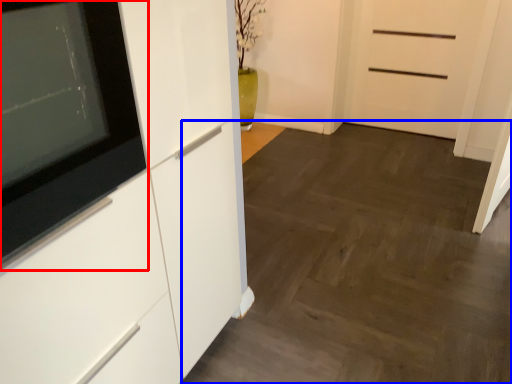
Question: Which object appears farthest to the camera in this image, appliance (highlighted by a red box) or plain (highlighted by a blue box)?

Choices:
 (A) appliance
 (B) plain

Answer: (B)